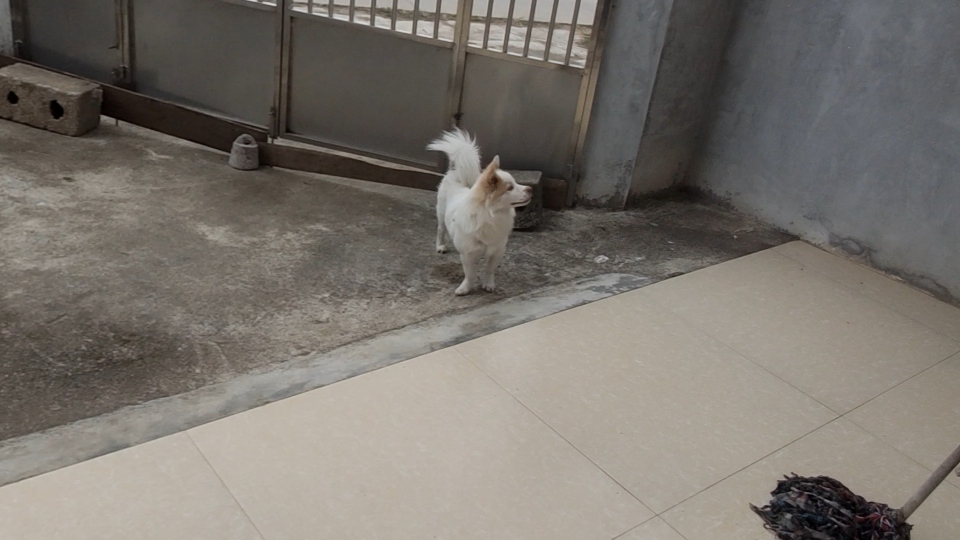
Find the location of a particular element. The width and height of the screenshot is (960, 540). wood planks is located at coordinates (108, 103), (189, 122), (276, 155), (404, 178).